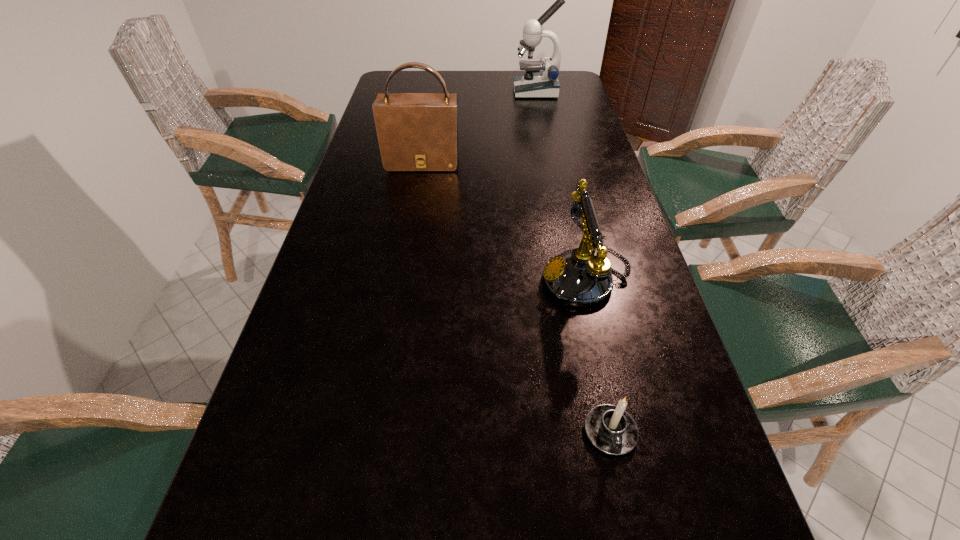
You are a GUI agent. You are given a task and a screenshot of the screen. Output one action in this format:
    pyautogui.click(x=<x>, y=<y>)
    Task: Click on the microscope
    The image size is (960, 540).
    Given the screenshot: What is the action you would take?
    pyautogui.click(x=545, y=84)

Where is `shoulder bag`? Image resolution: width=960 pixels, height=540 pixels. shoulder bag is located at coordinates (x=417, y=132).

This screenshot has height=540, width=960. What are the coordinates of `the leftmost object` in the screenshot? It's located at (417, 132).

This screenshot has width=960, height=540. Find the location of `the second shortest object`. the second shortest object is located at coordinates (579, 279).

I want to click on telephone, so click(579, 279).

Where is `the shortest object`? the shortest object is located at coordinates (612, 430).

Where is `candle holder`? This screenshot has height=540, width=960. candle holder is located at coordinates (612, 430).

Where is `vacant space located 0.080m on the back of the farthest object`? vacant space located 0.080m on the back of the farthest object is located at coordinates (533, 76).

The height and width of the screenshot is (540, 960). Find the location of `blank space located 0.220m on the front flap of the shoulder bag`. blank space located 0.220m on the front flap of the shoulder bag is located at coordinates (412, 222).

In order to click on vacant space located 0.060m on the dial of the third tallest object in this screenshot , I will do `click(515, 279)`.